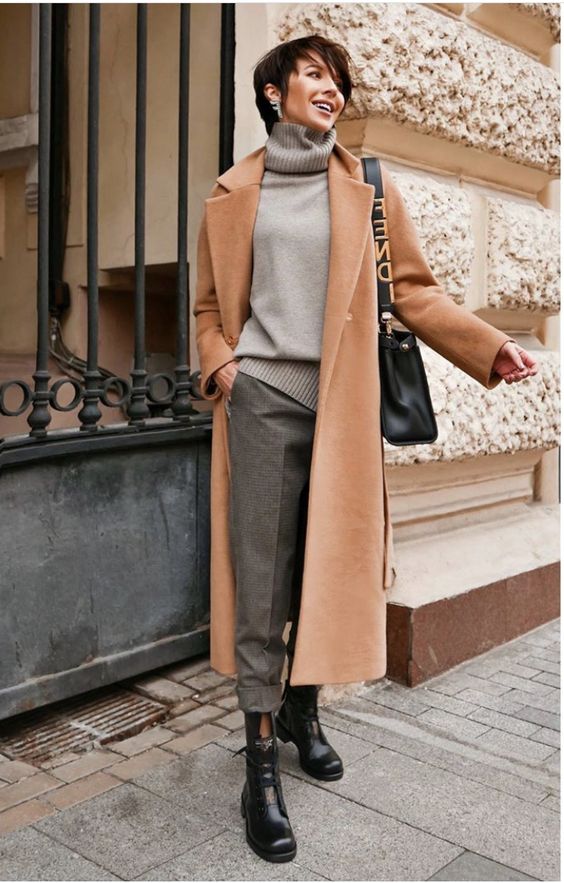
Identify the location of coat. The image size is (564, 883). (220, 599).